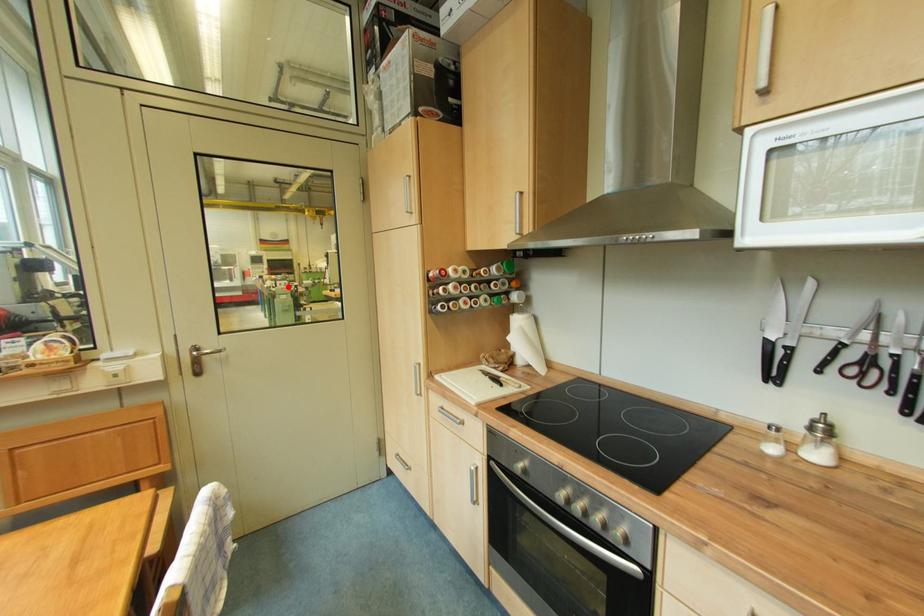
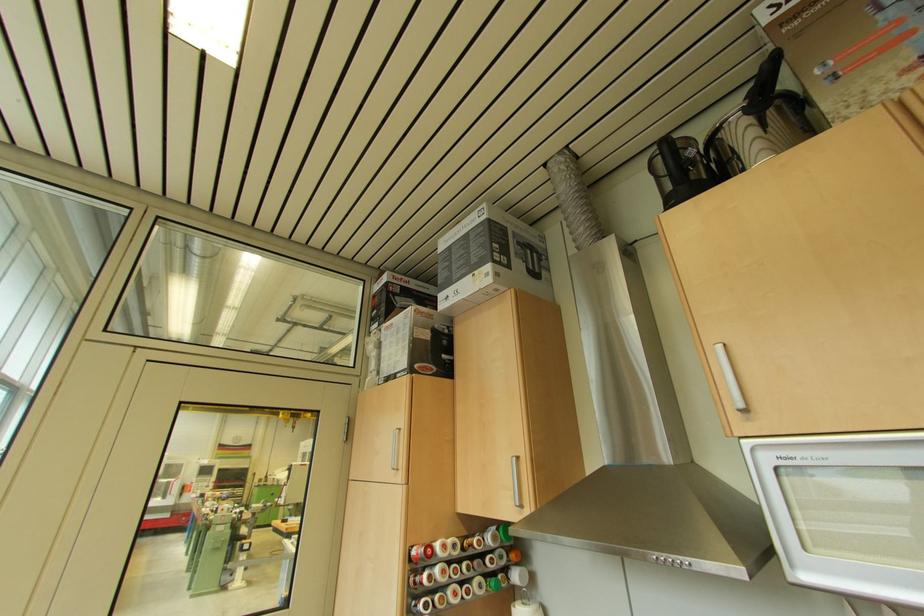
Where in the second image is the point corresponding to the highlighted location from the first image?

(229, 513)